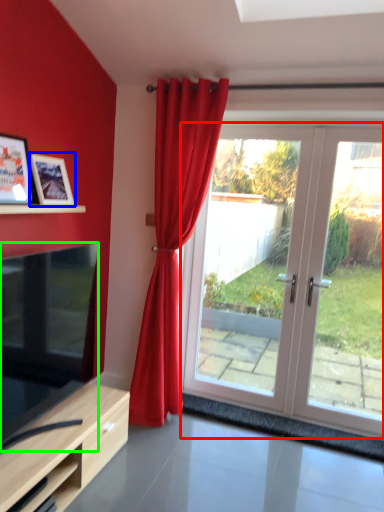
Question: Which is nearer to the door (highlighted by a red box)? picture frame (highlighted by a blue box) or television (highlighted by a green box).

Choices:
 (A) picture frame
 (B) television

Answer: (B)